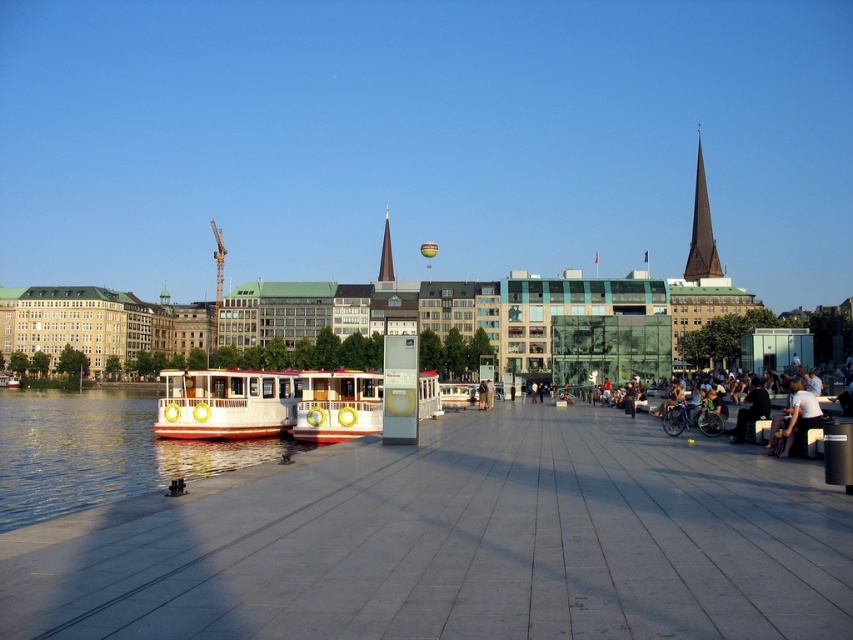
You are standing at the point marked by the coordinates (751,410) in the waterfront scene. Looking around, you see the dark gray fabric jacket at lower right. Which direction should you face to see the two small white boats with red accents docked on the left side of the promenade?

You should face to the left to see the two small white boats with red accents docked on the left side of the promenade, as they are positioned to the left of the promenade relative to your location at point (751,410).

You are standing at the point with coordinates point (776, 424) and want to walk towards the point with coordinates point (451, 403). Given the waterfront scene described, will you have an unobstructed path? Please explain your reasoning based on the spatial relationships provided.

The point (776, 424) is in front of point (451, 403). This means that the path between them might be obstructed because the starting point is closer to the viewer, making it harder to see or access the point behind it. However, since both points are on the paved promenade, there might be a clear path unless there are obstacles not mentioned in the scene description.